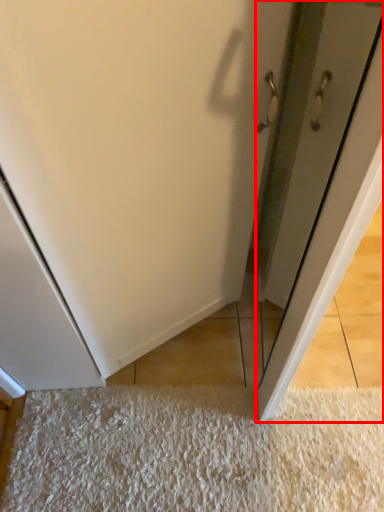
Question: From the image's perspective, what is the correct spatial positioning of door (annotated by the red box) in reference to mat?

Choices:
 (A) above
 (B) below

Answer: (A)